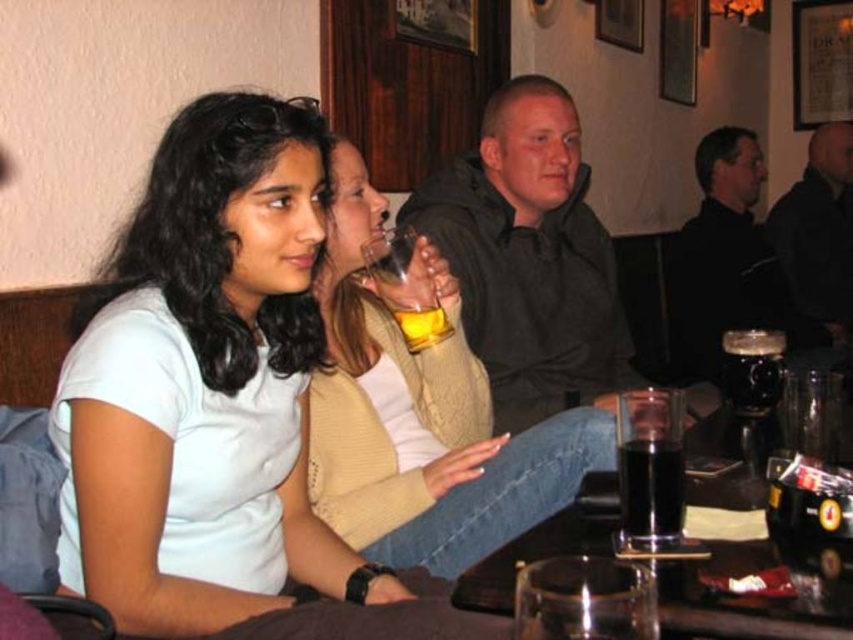
Who is shorter, black matte glass mug at upper right or dark glass at lower center?

With less height is dark glass at lower center.

Does black matte glass mug at upper right have a lesser width compared to dark glass at lower center?

In fact, black matte glass mug at upper right might be wider than dark glass at lower center.

Identify the location of black matte glass mug at upper right. (723, 257).

Which is behind, point (149, 438) or point (552, 122)?

The point (552, 122) is more distant.

Is point (131, 618) closer to viewer compared to point (550, 262)?

Yes, point (131, 618) is closer to viewer.

Locate an element on the screen. This screenshot has width=853, height=640. white matte shirt at center is located at coordinates (207, 380).

Is knitted beige sweater at center wider than dark gray hoodie at center?

Incorrect, knitted beige sweater at center's width does not surpass dark gray hoodie at center's.

Based on the photo, does knitted beige sweater at center come behind dark gray hoodie at center?

No, it is not.

Which is in front, point (477, 358) or point (488, 316)?

Point (477, 358)

You are a GUI agent. You are given a task and a screenshot of the screen. Output one action in this format:
    pyautogui.click(x=<x>, y=<y>)
    Task: Click on the knitted beige sweater at center
    The image size is (853, 640).
    Given the screenshot: What is the action you would take?
    pyautogui.click(x=422, y=417)